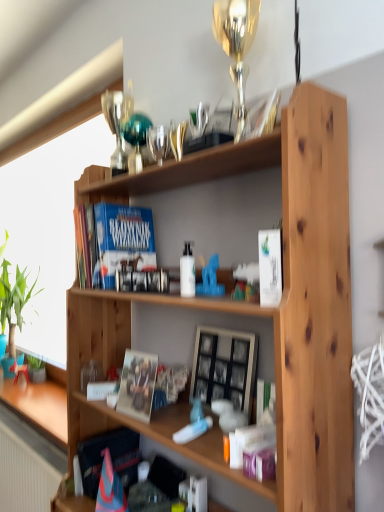
Locate an element on the screen. Image resolution: width=384 pixels, height=512 pixels. green matte plant at lower left, which is the second houseplant in left-to-right order is located at coordinates (x=36, y=369).

Measure the distance between green matte plant at lower left, the 1th houseplant in the right-to-left sequence, and camera.

2.49 meters.

What do you see at coordinates (137, 385) in the screenshot? I see `matte paper photo frame at center` at bounding box center [137, 385].

The width and height of the screenshot is (384, 512). I want to click on white matte paperback book at center-right, positioned as the 1th paperback book in right-to-left order, so click(x=270, y=267).

The height and width of the screenshot is (512, 384). I want to click on wooden shelf at center, so click(x=256, y=306).

Where is `green matte plant at lower left, positioned as the second houseplant in top-to-bottom order`? The width and height of the screenshot is (384, 512). green matte plant at lower left, positioned as the second houseplant in top-to-bottom order is located at coordinates (36, 369).

Does matte paper photo frame at center have a lesser height compared to matte white coffee cup at lower left?

No.

Can you tell me how much matte paper photo frame at center and matte white coffee cup at lower left differ in facing direction?

They differ by 7.51 degrees in their facing directions.

Is matte paper photo frame at center wider than matte white coffee cup at lower left?

Yes.

Which of these two, matte paper photo frame at center or matte white coffee cup at lower left, is bigger?

matte paper photo frame at center is bigger.

Does point (82, 386) appear closer or farther from the camera than point (262, 296)?

Point (82, 386) is positioned farther from the camera compared to point (262, 296).

In the image, there is a white matte paperback book at center-right, placed as the first paperback book when sorted from front to back. Where is `coffee cup below it (from a real-world perspective)`? The width and height of the screenshot is (384, 512). coffee cup below it (from a real-world perspective) is located at coordinates (90, 374).

Looking at their sizes, would you say matte white coffee cup at lower left is wider or thinner than white matte paperback book at center-right, acting as the second paperback book starting from the back?

matte white coffee cup at lower left is thinner than white matte paperback book at center-right, acting as the second paperback book starting from the back.

In the scene shown: Is matte white coffee cup at lower left taller or shorter than white matte paperback book at center-right, positioned as the 1th paperback book in right-to-left order?

Considering their sizes, matte white coffee cup at lower left has less height than white matte paperback book at center-right, positioned as the 1th paperback book in right-to-left order.

Considering the relative positions of white matte paperback book at center-right, acting as the second paperback book starting from the back, and matte white coffee cup at lower left in the image provided, is white matte paperback book at center-right, acting as the second paperback book starting from the back, to the right of matte white coffee cup at lower left from the viewer's perspective?

Indeed, white matte paperback book at center-right, acting as the second paperback book starting from the back, is positioned on the right side of matte white coffee cup at lower left.

In the scene shown: Measure the distance between white matte paperback book at center-right, the 2th paperback book positioned from the left, and matte white coffee cup at lower left.

white matte paperback book at center-right, the 2th paperback book positioned from the left, and matte white coffee cup at lower left are 36.06 inches apart.

Is white matte paperback book at center-right, positioned as the 1th paperback book in right-to-left order, aimed at matte white coffee cup at lower left?

No, white matte paperback book at center-right, positioned as the 1th paperback book in right-to-left order, does not turn towards matte white coffee cup at lower left.

Find the location of a particular element. The width and height of the screenshot is (384, 512). picture frame above the matte paper photo frame at center (from the image's perspective) is located at coordinates (225, 367).

Which object is wider, wooden picture frame at center or matte paper photo frame at center?

With larger width is wooden picture frame at center.

Is wooden picture frame at center facing towards matte paper photo frame at center?

Yes, wooden picture frame at center is turned towards matte paper photo frame at center.

Considering the positions of objects wooden picture frame at center and wooden shelf at center in the image provided, who is behind, wooden picture frame at center or wooden shelf at center?

wooden picture frame at center is more distant.

Is point (215, 390) farther from camera compared to point (351, 440)?

Yes, point (215, 390) is behind point (351, 440).

Between wooden picture frame at center and wooden shelf at center, which one has larger size?

Bigger between the two is wooden shelf at center.

Is blue matte book at upper left, the first paperback book in the left-to-right sequence, oriented towards green leafy plant at left, which appears as the second houseplant when ordered from the bottom?

No, blue matte book at upper left, the first paperback book in the left-to-right sequence, is not turned towards green leafy plant at left, which appears as the second houseplant when ordered from the bottom.

Between blue matte book at upper left, the first paperback book in the left-to-right sequence, and green leafy plant at left, the second houseplant positioned from the right, which one has larger size?

Bigger between the two is green leafy plant at left, the second houseplant positioned from the right.

Considering the relative positions of blue matte book at upper left, which appears as the second paperback book when viewed from the right, and green leafy plant at left, the second houseplant positioned from the right, in the image provided, is blue matte book at upper left, which appears as the second paperback book when viewed from the right, to the right of green leafy plant at left, the second houseplant positioned from the right, from the viewer's perspective?

Correct, you'll find blue matte book at upper left, which appears as the second paperback book when viewed from the right, to the right of green leafy plant at left, the second houseplant positioned from the right.

How distant is white matte paperback book at center-right, placed as the first paperback book when sorted from front to back, from blue matte book at upper left, which is counted as the second paperback book, starting from the front?

white matte paperback book at center-right, placed as the first paperback book when sorted from front to back, is 24.24 inches from blue matte book at upper left, which is counted as the second paperback book, starting from the front.

What's the angular difference between white matte paperback book at center-right, placed as the first paperback book when sorted from front to back, and blue matte book at upper left, the first paperback book in the left-to-right sequence,'s facing directions?

0.000499 degrees separate the facing orientations of white matte paperback book at center-right, placed as the first paperback book when sorted from front to back, and blue matte book at upper left, the first paperback book in the left-to-right sequence.

Can you confirm if white matte paperback book at center-right, the 2th paperback book positioned from the left, is wider than blue matte book at upper left, the first paperback book in the left-to-right sequence?

No, white matte paperback book at center-right, the 2th paperback book positioned from the left, is not wider than blue matte book at upper left, the first paperback book in the left-to-right sequence.

Which is in front, point (260, 234) or point (127, 265)?

The point (260, 234) is closer.

This screenshot has width=384, height=512. I want to click on coffee cup that appears below the matte paper photo frame at center (from a real-world perspective), so (x=90, y=374).

This screenshot has width=384, height=512. I want to click on the 2nd paperback book in front of the matte white coffee cup at lower left, counting from the anchor's position, so click(270, 267).

Which object lies nearer to the anchor point green leafy plant at left, positioned as the first houseplant in left-to-right order, blue matte book at upper left, which is counted as the second paperback book, starting from the front, or wooden picture frame at center?

blue matte book at upper left, which is counted as the second paperback book, starting from the front.

From the image, which object appears to be farther from green leafy plant at left, which is the first houseplant in top-to-bottom order, white matte paperback book at center-right, placed as the first paperback book when sorted from front to back, or wooden picture frame at center?

white matte paperback book at center-right, placed as the first paperback book when sorted from front to back.

Considering their positions, is white matte paperback book at center-right, acting as the second paperback book starting from the back, positioned further to green matte plant at lower left, which is the second houseplant in left-to-right order, than wooden picture frame at center?

The object further to green matte plant at lower left, which is the second houseplant in left-to-right order, is white matte paperback book at center-right, acting as the second paperback book starting from the back.

Based on their spatial positions, is green matte plant at lower left, positioned as the second houseplant in top-to-bottom order, or white matte paperback book at center-right, acting as the second paperback book starting from the back, further from matte paper photo frame at center?

green matte plant at lower left, positioned as the second houseplant in top-to-bottom order, is further to matte paper photo frame at center.

From the image, which object appears to be farther from green leafy plant at left, arranged as the 1th houseplant when viewed from the back, matte white coffee cup at lower left or matte paper photo frame at center?

matte paper photo frame at center lies further to green leafy plant at left, arranged as the 1th houseplant when viewed from the back, than the other object.

From the image, which object appears to be farther from blue matte book at upper left, the first paperback book in the left-to-right sequence, wooden picture frame at center or white matte paperback book at center-right, positioned as the 1th paperback book in right-to-left order?

The object further to blue matte book at upper left, the first paperback book in the left-to-right sequence, is white matte paperback book at center-right, positioned as the 1th paperback book in right-to-left order.

Considering their positions, is blue matte book at upper left, which appears as the second paperback book when viewed from the right, positioned closer to wooden picture frame at center than green matte plant at lower left, acting as the 1th houseplant starting from the bottom?

blue matte book at upper left, which appears as the second paperback book when viewed from the right.

When comparing their distances from green leafy plant at left, arranged as the 1th houseplant when viewed from the back, does white matte paperback book at center-right, the 2th paperback book positioned from the left, or wooden shelf at center seem closer?

The object closer to green leafy plant at left, arranged as the 1th houseplant when viewed from the back, is wooden shelf at center.

Image resolution: width=384 pixels, height=512 pixels. What are the coordinates of `houseplant between white glossy bottle at center and green leafy plant at left, the second houseplant positioned from the right, in the front-back direction` in the screenshot? It's located at pyautogui.click(x=36, y=369).

At what (x,y) coordinates should I click in order to perform the action: click on picture frame located between white glossy bottle at center and green matte plant at lower left, acting as the 1th houseplant starting from the bottom, in the depth direction. Please return your answer as a coordinate pair (x, y). This screenshot has height=512, width=384. Looking at the image, I should click on (225, 367).

Find the location of a particular element. This screenshot has height=512, width=384. picture frame between wooden shelf at center and blue matte book at upper left, the first paperback book in the left-to-right sequence, along the z-axis is located at coordinates (225, 367).

Where is `picture frame between white matte paperback book at center-right, acting as the second paperback book starting from the back, and matte white coffee cup at lower left, along the z-axis`? The width and height of the screenshot is (384, 512). picture frame between white matte paperback book at center-right, acting as the second paperback book starting from the back, and matte white coffee cup at lower left, along the z-axis is located at coordinates (225, 367).